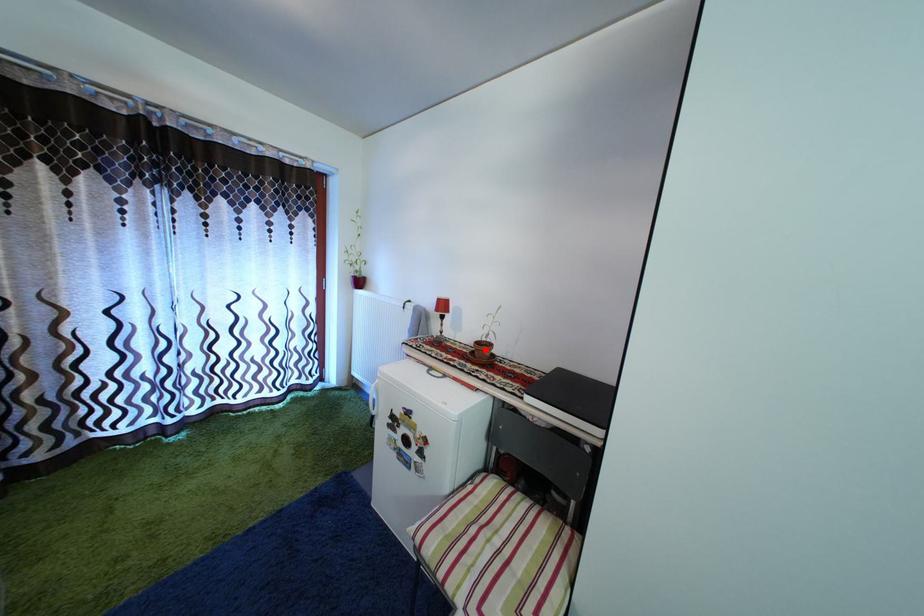
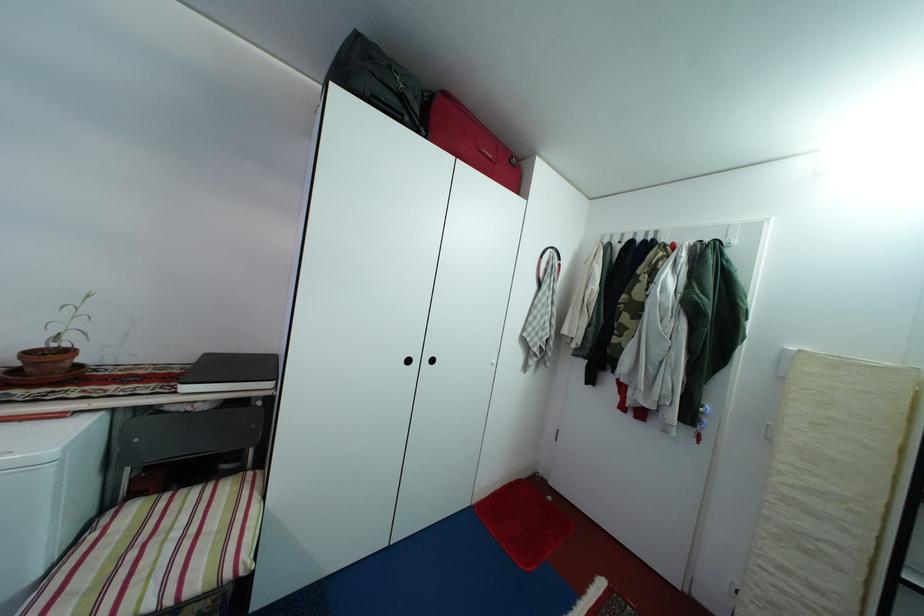
Question: I am providing you with two images of the same scene from different viewpoints. Image1 has a red point marked. In image2, the corresponding 3D location appears at what relative position? Reply with the corresponding letter.

Choices:
 (A) Closer
 (B) Farther

Answer: (A)